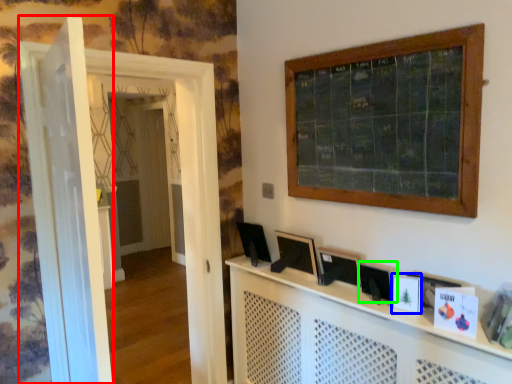
Question: Estimate the real-world distances between objects in this image. Which object is closer to door (highlighted by a red box), picture frame (highlighted by a blue box) or picture frame (highlighted by a green box)?

Choices:
 (A) picture frame
 (B) picture frame

Answer: (B)